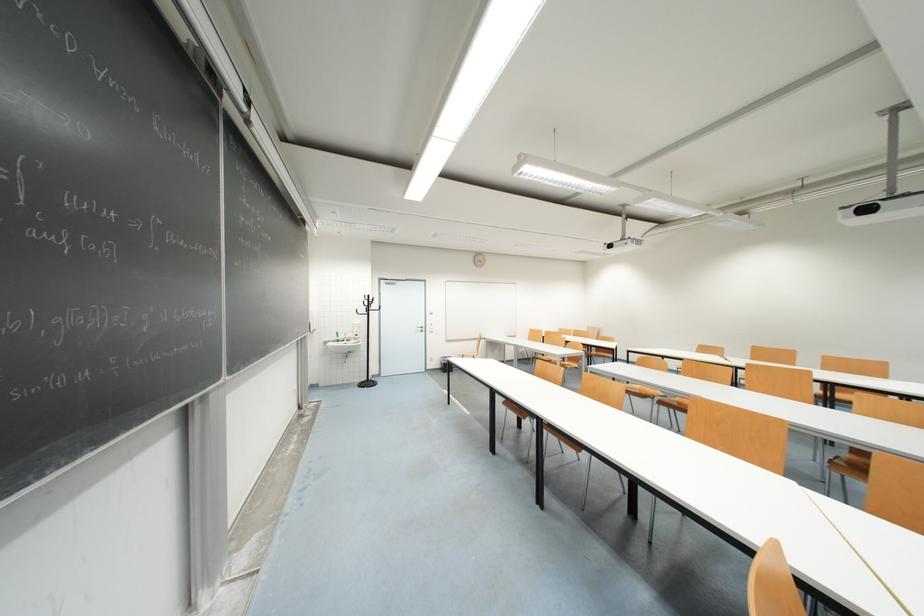
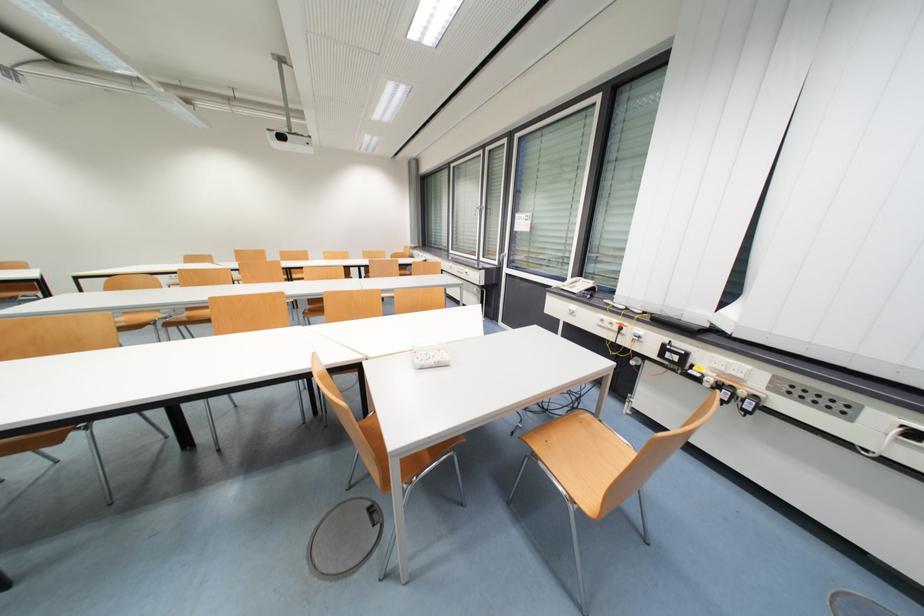
In the second image, find the point that corresponds to (871,212) in the first image.

(286, 139)